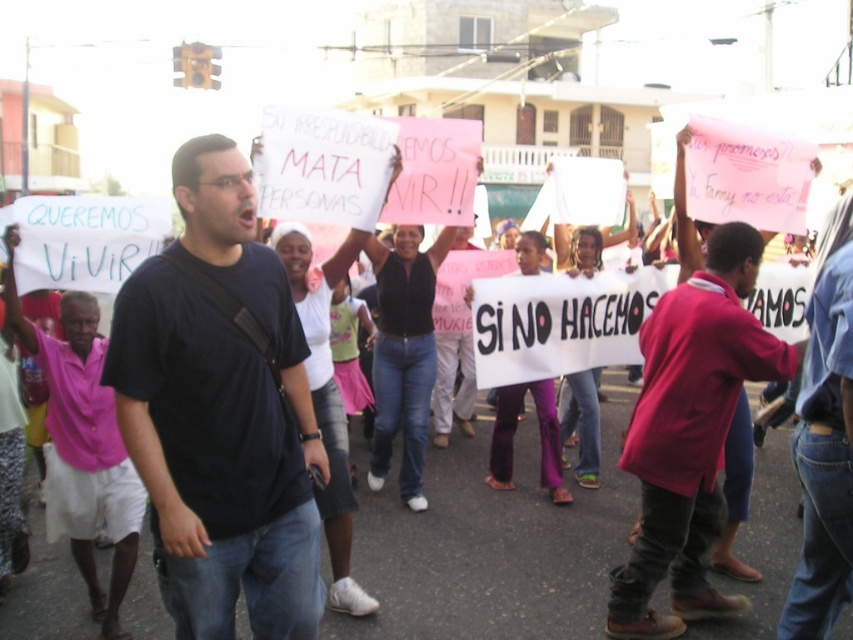
Who is positioned more to the right, dark blue t-shirt at center or red cotton shirt at center?

red cotton shirt at center

Is dark blue t-shirt at center wider than red cotton shirt at center?

No.

This screenshot has height=640, width=853. What are the coordinates of `dark blue t-shirt at center` in the screenshot? It's located at (219, 412).

This screenshot has height=640, width=853. I want to click on dark blue t-shirt at center, so click(x=219, y=412).